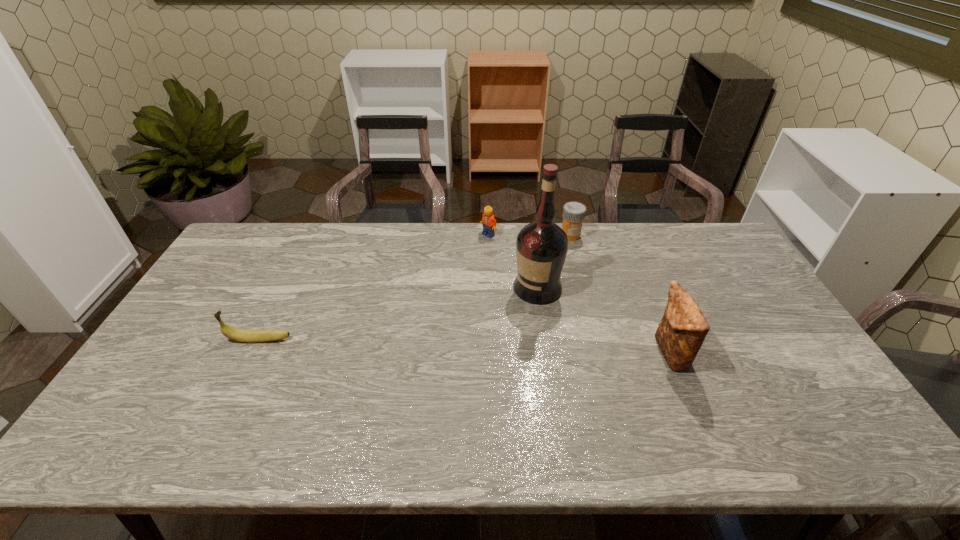
The image size is (960, 540). I want to click on the leftmost object, so click(249, 336).

Image resolution: width=960 pixels, height=540 pixels. Identify the location of the rightmost object. (683, 328).

At what (x,y) coordinates should I click in order to perform the action: click on clutch bag. Please return your answer as a coordinate pair (x, y). Looking at the image, I should click on (683, 328).

Identify the location of medicine. (573, 215).

Locate an element on the screen. The width and height of the screenshot is (960, 540). liquor is located at coordinates (541, 248).

The height and width of the screenshot is (540, 960). Identify the location of the third object from right to left. click(541, 248).

At what (x,y) coordinates should I click in order to perform the action: click on Lego. Please return your answer as a coordinate pair (x, y). Looking at the image, I should click on (489, 223).

The width and height of the screenshot is (960, 540). Find the location of `vacant region located at the stem of the banana`. vacant region located at the stem of the banana is located at coordinates (188, 340).

Where is `vacant area situated 0.130m at the stem of the banana`? vacant area situated 0.130m at the stem of the banana is located at coordinates (180, 340).

Locate an element on the screen. The image size is (960, 540). free space located on the open side of the second tallest object is located at coordinates (548, 354).